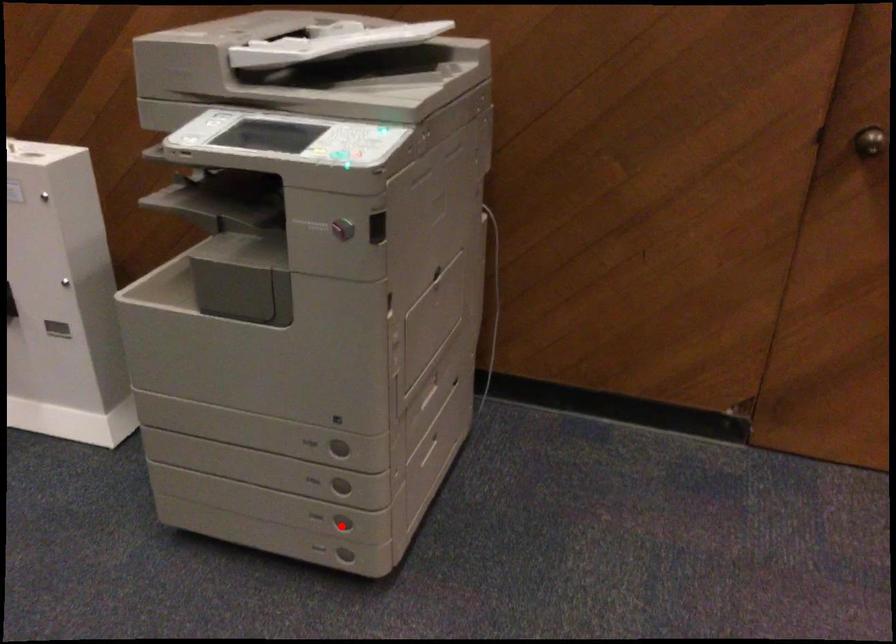
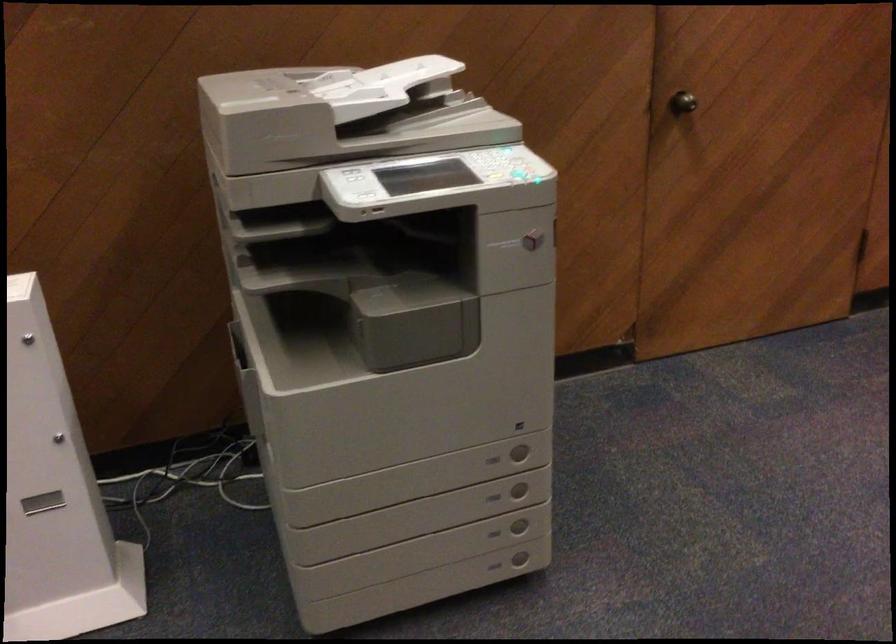
Find the pixel in the second image that matches the highlighted location in the first image.

(519, 527)